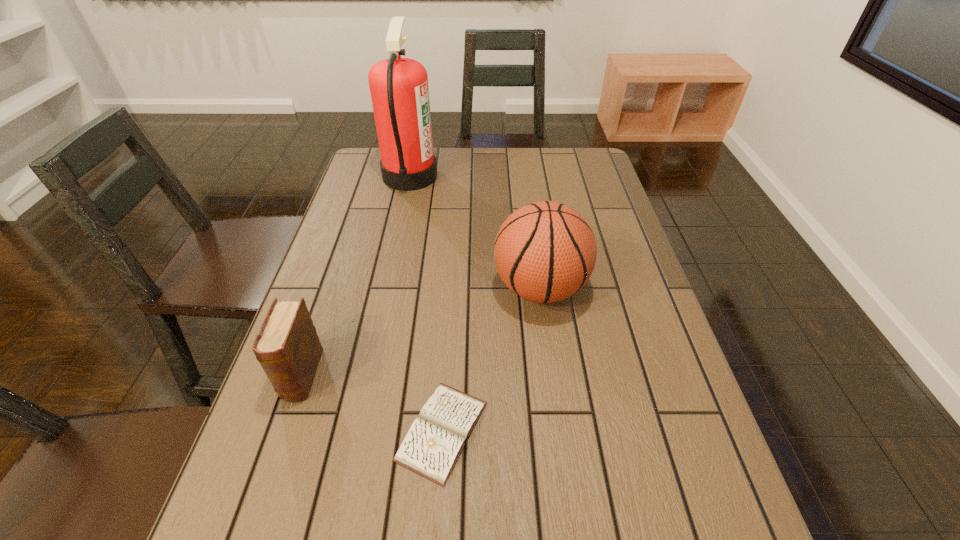
The width and height of the screenshot is (960, 540). Identify the location of blank area located on the side where the inflation valve is located. (420, 288).

I want to click on vacant area situated on the side where the inflation valve is located, so click(x=361, y=288).

Where is `vacant space situated on the spine side of the left diary`? vacant space situated on the spine side of the left diary is located at coordinates (255, 514).

This screenshot has height=540, width=960. What are the coordinates of `vacant region located 0.050m on the left of the right diary` in the screenshot? It's located at (371, 431).

You are a GUI agent. You are given a task and a screenshot of the screen. Output one action in this format:
    pyautogui.click(x=<x>, y=<y>)
    Task: Click on the object that is at the far edge
    This screenshot has height=540, width=960.
    Given the screenshot: What is the action you would take?
    pyautogui.click(x=399, y=90)

The image size is (960, 540). I want to click on fire extinguisher that is at the left edge, so click(399, 90).

Identify the location of diary positioned at the left edge. This screenshot has width=960, height=540. (287, 346).

The width and height of the screenshot is (960, 540). Identify the location of object that is at the right edge. (545, 251).

I want to click on object present at the far left corner, so click(399, 90).

Locate an element on the screen. free space at the far edge is located at coordinates (545, 148).